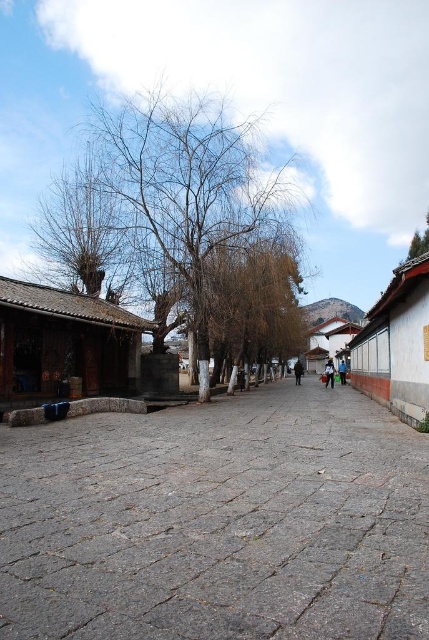
Is bare branches at left to the left of green fabric bag at center from the viewer's perspective?

Yes, bare branches at left is to the left of green fabric bag at center.

Which of these two, bare branches at left or green fabric bag at center, stands shorter?

With less height is green fabric bag at center.

Is point (187, 288) behind point (326, 369)?

That is False.

Identify the location of bare branches at left. The image size is (429, 640). (187, 188).

Who is more forward, (99, 193) or (326, 381)?

Positioned in front is point (99, 193).

Which is more to the right, bare branches at upper left or green fabric bag at center?

From the viewer's perspective, green fabric bag at center appears more on the right side.

Between point (73, 224) and point (329, 381), which one is positioned in front?

Point (73, 224)

This screenshot has width=429, height=640. What are the coordinates of `bare branches at upper left` in the screenshot? It's located at (84, 234).

Looking at this image, can you confirm if green fabric bag at center is taller than black leather jacket at center?

Incorrect, green fabric bag at center's height is not larger of black leather jacket at center's.

Is green fabric bag at center closer to the viewer compared to black leather jacket at center?

Yes, it is.

At what (x,y) coordinates should I click in order to perform the action: click on green fabric bag at center. Please return your answer as a coordinate pair (x, y). The image size is (429, 640). Looking at the image, I should click on click(x=329, y=372).